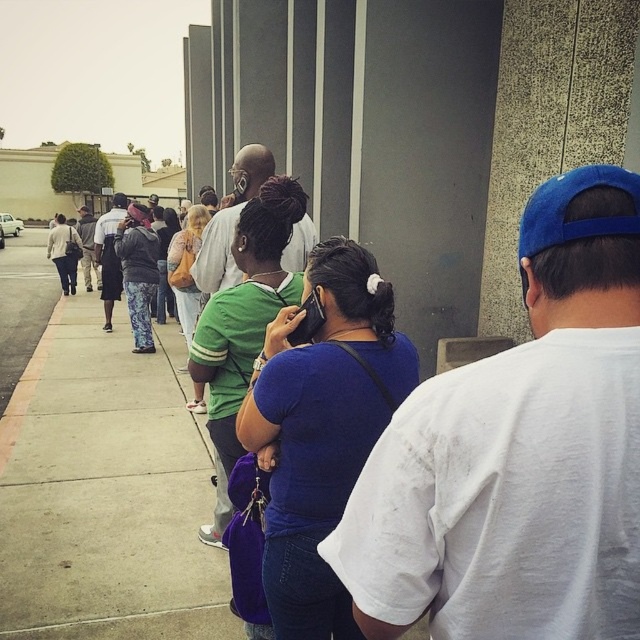
Is point (589, 308) behind point (298, 397)?

No, (589, 308) is in front of (298, 397).

Does point (333, 529) come behind point (321, 266)?

No, it is not.

This screenshot has height=640, width=640. I want to click on white cotton shirt at center, so click(x=518, y=452).

Is point (284, 564) farther from viewer compared to point (10, 432)?

No.

Which is in front, point (320, 260) or point (12, 435)?

Point (320, 260) is more forward.

At what (x,y) coordinates should I click in order to perform the action: click on blue matte shirt at center. Please return your answer as a coordinate pair (x, y). Image resolution: width=640 pixels, height=640 pixels. Looking at the image, I should click on (321, 428).

From the picture: Which of these two, white cotton shirt at center or concrete sidewalk at center, stands shorter?

concrete sidewalk at center

Where is `white cotton shirt at center`? The width and height of the screenshot is (640, 640). white cotton shirt at center is located at coordinates coord(518,452).

You are a GUI agent. You are given a task and a screenshot of the screen. Output one action in this format:
    pyautogui.click(x=<x>, y=<y>)
    Task: Click on the white cotton shirt at center
    
    Given the screenshot: What is the action you would take?
    pyautogui.click(x=518, y=452)